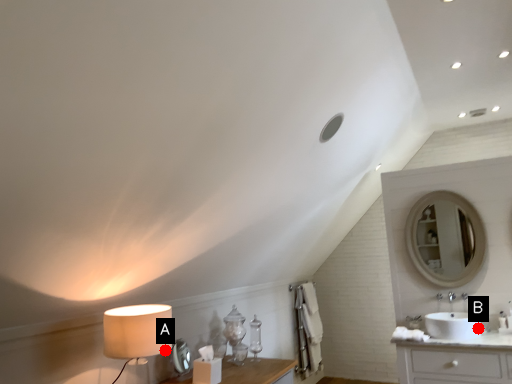
Question: Two points are circled on the image, labeled by A and B beside each circle. Which point is farther from the camera taking this photo?

Choices:
 (A) A is further
 (B) B is further

Answer: (B)